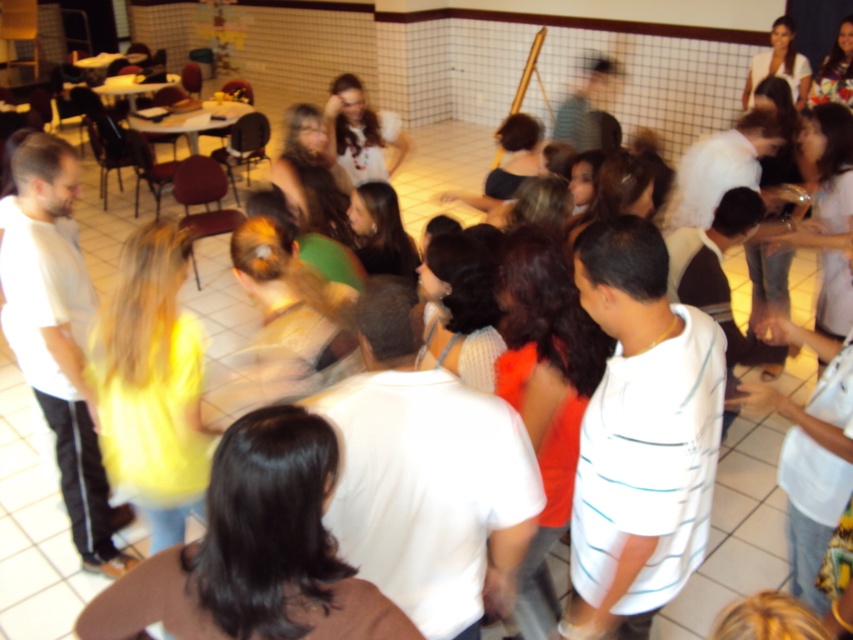
Does white striped shirt at center appear over brown hair at center?

Indeed, white striped shirt at center is positioned over brown hair at center.

Can you confirm if white striped shirt at center is taller than brown hair at center?

Correct, white striped shirt at center is much taller as brown hair at center.

Who is more forward, (689,524) or (312,483)?

Point (312,483) is in front.

Find the location of a particular element. The height and width of the screenshot is (640, 853). white striped shirt at center is located at coordinates (640, 436).